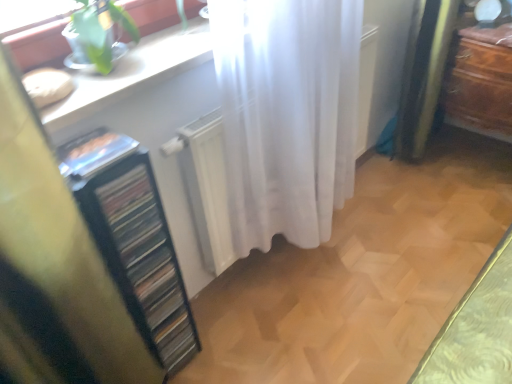
Question: From a real-world perspective, is black plastic file cabinet at left physically below white sheer curtain at center?

Choices:
 (A) yes
 (B) no

Answer: (B)

Question: Is black plastic file cabinet at left at the right side of white sheer curtain at center?

Choices:
 (A) yes
 (B) no

Answer: (B)

Question: From a real-world perspective, is black plastic file cabinet at left physically above white sheer curtain at center?

Choices:
 (A) yes
 (B) no

Answer: (A)

Question: Is white sheer curtain at center inside black plastic file cabinet at left?

Choices:
 (A) no
 (B) yes

Answer: (A)

Question: Is black plastic file cabinet at left thinner than white sheer curtain at center?

Choices:
 (A) no
 (B) yes

Answer: (A)

Question: Is black plastic file cabinet at left oriented towards white sheer curtain at center?

Choices:
 (A) yes
 (B) no

Answer: (B)

Question: Is white sheer curtain at center far away from white glossy counter top at upper left?

Choices:
 (A) no
 (B) yes

Answer: (A)

Question: Is white sheer curtain at center further to camera compared to white glossy counter top at upper left?

Choices:
 (A) no
 (B) yes

Answer: (B)

Question: Does white sheer curtain at center appear on the left side of white glossy counter top at upper left?

Choices:
 (A) no
 (B) yes

Answer: (A)

Question: From a real-world perspective, is white sheer curtain at center on white glossy counter top at upper left?

Choices:
 (A) no
 (B) yes

Answer: (A)

Question: Can you confirm if white sheer curtain at center is taller than white glossy counter top at upper left?

Choices:
 (A) yes
 (B) no

Answer: (A)

Question: Does white sheer curtain at center have a smaller size compared to white glossy counter top at upper left?

Choices:
 (A) no
 (B) yes

Answer: (A)

Question: Can brown wooden dresser at right be found inside white glossy counter top at upper left?

Choices:
 (A) no
 (B) yes

Answer: (A)